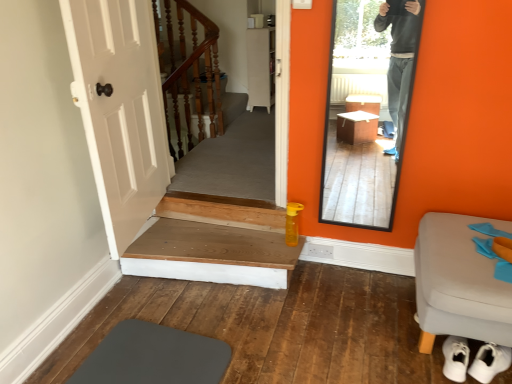
What do you see at coordinates (261, 67) in the screenshot?
I see `white matte cabinet at center` at bounding box center [261, 67].

Identify the location of white fabric stool at lower right. (459, 283).

In order to face clear glass mirror at right, should I rotate leftwards or rightwards?

Turn right approximately 14.411 degrees to face it.

The width and height of the screenshot is (512, 384). Find the location of `wooden at upper left, which is the 1th stairs in top-to-bottom order`. wooden at upper left, which is the 1th stairs in top-to-bottom order is located at coordinates (188, 75).

Which object is positioned more to the right, white matte cabinet at center or clear glass mirror at right?

From the viewer's perspective, clear glass mirror at right appears more on the right side.

This screenshot has height=384, width=512. Identify the location of cabinetry located behind the clear glass mirror at right. (261, 67).

Considering the sizes of objects white matte cabinet at center and clear glass mirror at right in the image provided, who is smaller, white matte cabinet at center or clear glass mirror at right?

clear glass mirror at right is smaller.

Looking at this image, measure the distance between white matte cabinet at center and clear glass mirror at right.

They are 3.92 feet apart.

Measure the distance between wooden at upper left, the 2th stairs from the bottom, and clear glass mirror at right.

They are 1.50 meters apart.

Find the location of a particular element. mirror beneath the wooden at upper left, the 2th stairs from the bottom (from a real-world perspective) is located at coordinates (367, 109).

Is wooden at upper left, which is counted as the second stairs, starting from the front, shorter than clear glass mirror at right?

Indeed, wooden at upper left, which is counted as the second stairs, starting from the front, has a lesser height compared to clear glass mirror at right.

Can you confirm if wooden at upper left, which is the 1th stairs in top-to-bottom order, is thinner than clear glass mirror at right?

Incorrect, the width of wooden at upper left, which is the 1th stairs in top-to-bottom order, is not less than that of clear glass mirror at right.

From a real-world perspective, is white fabric stool at lower right below clear glass mirror at right?

Indeed, from a real-world perspective, white fabric stool at lower right is positioned beneath clear glass mirror at right.

Considering the positions of objects white fabric stool at lower right and clear glass mirror at right in the image provided, who is behind, white fabric stool at lower right or clear glass mirror at right?

clear glass mirror at right is further away from the camera.

How far apart are white fabric stool at lower right and clear glass mirror at right?

A distance of 4.62 feet exists between white fabric stool at lower right and clear glass mirror at right.

Is white fabric stool at lower right aimed at clear glass mirror at right?

No.

Which object is closer to the camera, white fabric stool at lower right or white matte cabinet at center?

white fabric stool at lower right is more forward.

Would you consider white fabric stool at lower right to be distant from white matte cabinet at center?

Indeed, white fabric stool at lower right is not near white matte cabinet at center.

Considering the sizes of objects white fabric stool at lower right and white matte cabinet at center in the image provided, who is taller, white fabric stool at lower right or white matte cabinet at center?

white matte cabinet at center is taller.

Does wooden at bottom, placed as the 1th stairs when sorted from bottom to top, come behind white fabric stool at lower right?

Yes, it is.

Is wooden at bottom, which is the 2th stairs from back to front, far from white fabric stool at lower right?

Yes, wooden at bottom, which is the 2th stairs from back to front, is far from white fabric stool at lower right.

Considering the positions of objects wooden at bottom, placed as the 1th stairs when sorted from bottom to top, and white fabric stool at lower right in the image provided, who is more to the left, wooden at bottom, placed as the 1th stairs when sorted from bottom to top, or white fabric stool at lower right?

From the viewer's perspective, wooden at bottom, placed as the 1th stairs when sorted from bottom to top, appears more on the left side.

Is white fabric stool at lower right inside wooden at bottom, the 1th stairs when ordered from front to back?

Actually, white fabric stool at lower right is outside wooden at bottom, the 1th stairs when ordered from front to back.

From a real-world perspective, is clear glass mirror at right under wooden at upper left, the 2th stairs from the bottom?

Indeed, from a real-world perspective, clear glass mirror at right is positioned beneath wooden at upper left, the 2th stairs from the bottom.

In the scene shown: Is clear glass mirror at right in contact with wooden at upper left, the 2th stairs from the bottom?

There is a gap between clear glass mirror at right and wooden at upper left, the 2th stairs from the bottom.

Is clear glass mirror at right further to the viewer compared to wooden at upper left, which is counted as the second stairs, starting from the front?

No, clear glass mirror at right is closer to the camera.

From the image's perspective, is wooden at bottom, the 1th stairs when ordered from front to back, under white matte cabinet at center?

Yes, from the image's perspective, wooden at bottom, the 1th stairs when ordered from front to back, is beneath white matte cabinet at center.

From a real-world perspective, which is physically below, wooden at bottom, placed as the 1th stairs when sorted from bottom to top, or white matte cabinet at center?

wooden at bottom, placed as the 1th stairs when sorted from bottom to top.

Is wooden at bottom, placed as the 1th stairs when sorted from bottom to top, wider or thinner than white matte cabinet at center?

wooden at bottom, placed as the 1th stairs when sorted from bottom to top, is wider than white matte cabinet at center.

Is wooden at bottom, marked as the 2th stairs in a top-to-bottom arrangement, not inside white matte cabinet at center?

Result: Yes.

This screenshot has width=512, height=384. I want to click on mirror located in front of the white matte cabinet at center, so click(367, 109).

Which stairs is the 2nd one when counting from the left side of the clear glass mirror at right? Please provide its 2D coordinates.

[(188, 75)]

From the image, which object appears to be nearer to clear glass mirror at right, wooden at bottom, the 1th stairs when ordered from front to back, or wooden at upper left, which is the 1th stairs in top-to-bottom order?

wooden at bottom, the 1th stairs when ordered from front to back, lies closer to clear glass mirror at right than the other object.

When comparing their distances from white fabric stool at lower right, does wooden at bottom, marked as the 2th stairs in a top-to-bottom arrangement, or white matte cabinet at center seem further?

The object further to white fabric stool at lower right is white matte cabinet at center.

Looking at this image, based on their spatial positions, is wooden at bottom, marked as the 2th stairs in a top-to-bottom arrangement, or wooden at upper left, arranged as the 1th stairs when viewed from the back, further from white fabric stool at lower right?

Based on the image, wooden at upper left, arranged as the 1th stairs when viewed from the back, appears to be further to white fabric stool at lower right.

Based on their spatial positions, is white fabric stool at lower right or white matte cabinet at center further from wooden at upper left, which is the 1th stairs in top-to-bottom order?

Based on the image, white fabric stool at lower right appears to be further to wooden at upper left, which is the 1th stairs in top-to-bottom order.

Based on their spatial positions, is clear glass mirror at right or wooden at bottom, the 1th stairs when ordered from front to back, further from white matte cabinet at center?

The object further to white matte cabinet at center is wooden at bottom, the 1th stairs when ordered from front to back.

Considering their positions, is white fabric stool at lower right positioned further to wooden at upper left, arranged as the 1th stairs when viewed from the back, than clear glass mirror at right?

The object further to wooden at upper left, arranged as the 1th stairs when viewed from the back, is white fabric stool at lower right.

From the picture: From the image, which object appears to be farther from wooden at bottom, marked as the 2th stairs in a top-to-bottom arrangement, wooden at upper left, arranged as the 1th stairs when viewed from the back, or white fabric stool at lower right?

wooden at upper left, arranged as the 1th stairs when viewed from the back, is further to wooden at bottom, marked as the 2th stairs in a top-to-bottom arrangement.

From the image, which object appears to be nearer to wooden at bottom, marked as the 2th stairs in a top-to-bottom arrangement, white matte cabinet at center or clear glass mirror at right?

clear glass mirror at right is positioned closer to the anchor wooden at bottom, marked as the 2th stairs in a top-to-bottom arrangement.

You are a GUI agent. You are given a task and a screenshot of the screen. Output one action in this format:
    pyautogui.click(x=<x>, y=<y>)
    Task: Click on the mirror between white fabric stool at lower right and wooden at upper left, arranged as the 1th stairs when viewed from the back, in the front-back direction
    This screenshot has width=512, height=384.
    Given the screenshot: What is the action you would take?
    pyautogui.click(x=367, y=109)

This screenshot has height=384, width=512. I want to click on mirror between white fabric stool at lower right and white matte cabinet at center from front to back, so click(x=367, y=109).

This screenshot has height=384, width=512. I want to click on stairs between wooden at bottom, which is the 2th stairs from back to front, and white matte cabinet at center in the front-back direction, so click(188, 75).

Locate an element on the screen. The height and width of the screenshot is (384, 512). mirror located between wooden at bottom, which is the 2th stairs from back to front, and white fabric stool at lower right in the left-right direction is located at coordinates (367, 109).